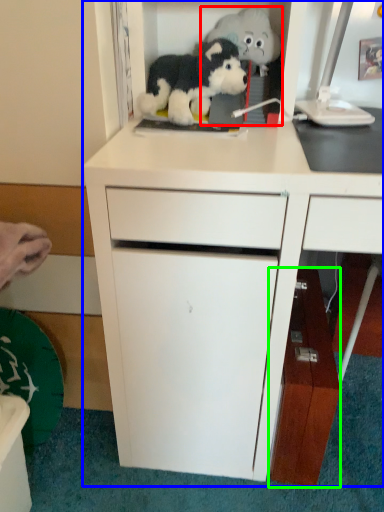
Question: Which is farther away from toy (highlighted by a red box)? cabinetry (highlighted by a blue box) or cabinetry (highlighted by a green box)?

Choices:
 (A) cabinetry
 (B) cabinetry

Answer: (B)